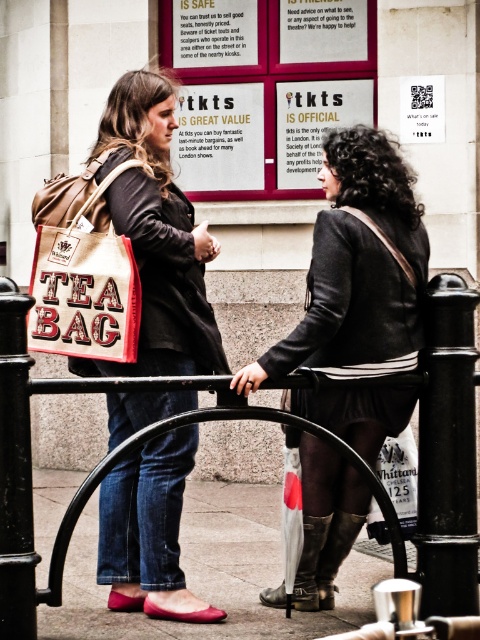
You are a delivery robot trying to deliver a package to the person with the leather boots at lower center. The beige canvas tea bag at center is blocking the path. Can you move the tea bag to access the boots?

The beige canvas tea bag at center is positioned over leather boots at lower center, so moving the tea bag would allow access to the boots.

You are standing at the position of point (x=432, y=612) and want to move to the position of point (x=404, y=406). Can you walk directly towards it without going around?

Point (x=404, y=406) is behind point (x=432, y=612), so you cannot walk directly towards it without going around.

You are a delivery robot with a box that is 18 inches wide. You need to navigate between the matte black jacket at center and the black metal rail at center. Can you fit through the space between them?

The matte black jacket at center is 17.93 inches away from the black metal rail at center. Since the distance between them is less than the 18 inch width of the robot, the robot cannot fit through the space between them.